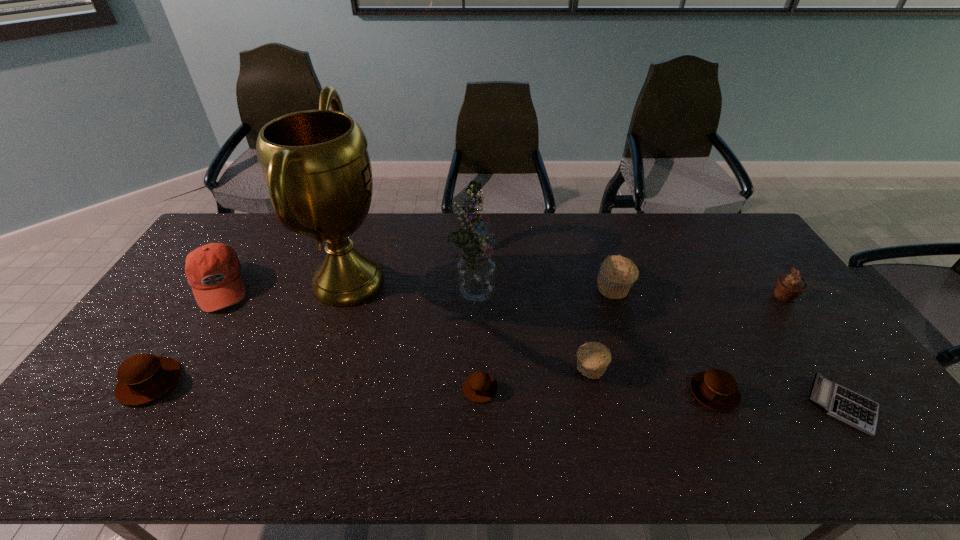
Locate an element on the screen. This screenshot has height=540, width=960. the leftmost muffin is located at coordinates (143, 378).

I want to click on the biggest brown muffin, so click(143, 378).

Where is `the second smallest brown muffin`? the second smallest brown muffin is located at coordinates (716, 389).

Identify the location of the third object from right to left. (716, 389).

This screenshot has height=540, width=960. What are the coordinates of `the fifth muffin from right to left` in the screenshot? It's located at (479, 387).

Where is `the ninth tallest object`? the ninth tallest object is located at coordinates (479, 387).

Image resolution: width=960 pixels, height=540 pixels. Identify the location of the shortest object. [850, 407].

Where is `vacant position located on the surface of the tallest object with symbols`? The image size is (960, 540). vacant position located on the surface of the tallest object with symbols is located at coordinates (406, 282).

Image resolution: width=960 pixels, height=540 pixels. What are the coordinates of `vacant space situated 0.290m on the front-facing side of the green bouquet` in the screenshot? It's located at coord(591,291).

You are a GUI agent. You are given a task and a screenshot of the screen. Output one action in this format:
    pyautogui.click(x=<x>, y=<y>)
    Task: Click on the vacant space situated on the front of the baseball cap
    This screenshot has height=540, width=960.
    Given the screenshot: What is the action you would take?
    pyautogui.click(x=171, y=362)